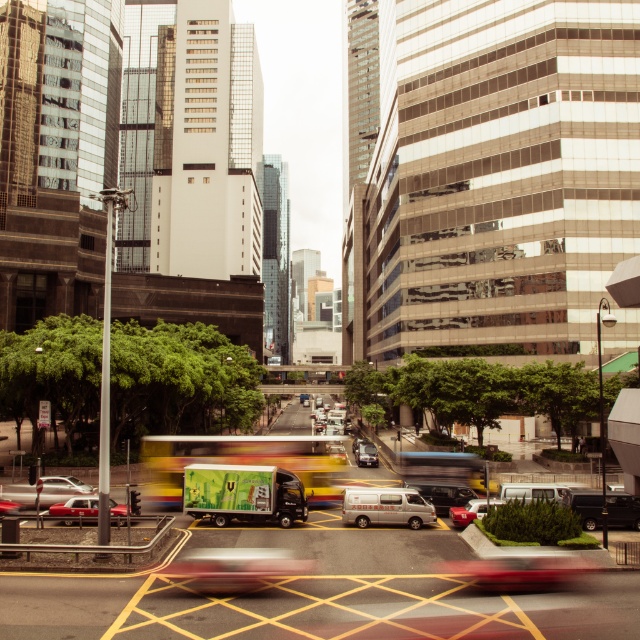
Is green matte truck at center above white matte van at center?

Indeed, green matte truck at center is positioned over white matte van at center.

Can you confirm if green matte truck at center is bigger than white matte van at center?

Yes.

Who is more forward, (x=257, y=486) or (x=397, y=490)?

Point (x=257, y=486) is more forward.

The height and width of the screenshot is (640, 640). I want to click on green matte truck at center, so click(243, 493).

Is green matte truck at center below shiny red car at center?

Actually, green matte truck at center is above shiny red car at center.

Which is more to the right, green matte truck at center or shiny red car at center?

From the viewer's perspective, shiny red car at center appears more on the right side.

This screenshot has width=640, height=640. Find the location of `green matte truck at center`. green matte truck at center is located at coordinates (243, 493).

Does green matte truck at center lie behind silver metallic sedan at lower left?

That is False.

Describe the element at coordinates (243, 493) in the screenshot. This screenshot has width=640, height=640. I see `green matte truck at center` at that location.

Is point (269, 484) closer to camera compared to point (8, 497)?

Yes, point (269, 484) is in front of point (8, 497).

Image resolution: width=640 pixels, height=640 pixels. Identify the location of green matte truck at center. tap(243, 493).